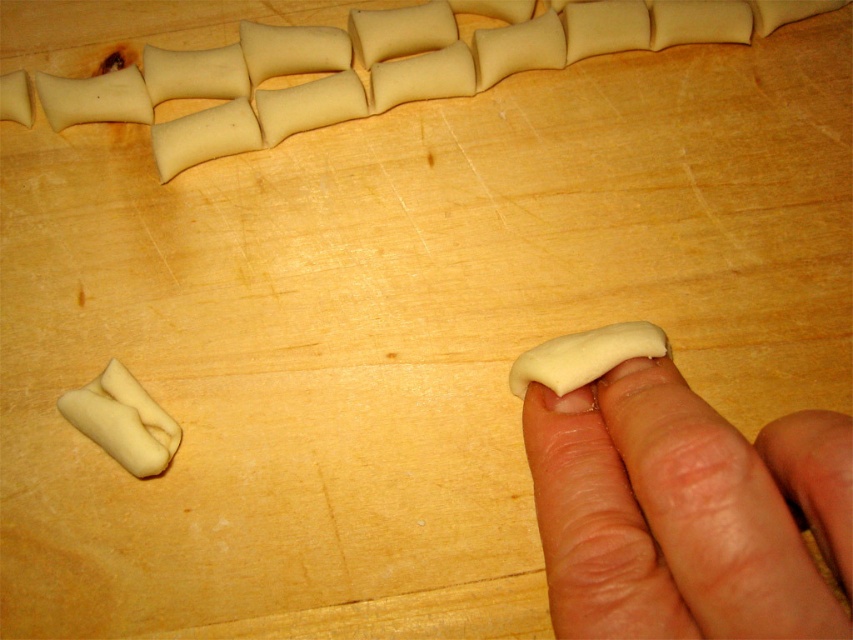
Question: Which is nearer to the white dough at center?

Choices:
 (A) smooth flesh at center
 (B) white dough at upper center
 (C) white dough at lower right

Answer: (C)

Question: Which is nearer to the white dough at upper center?

Choices:
 (A) white dough at lower right
 (B) white dough at center
 (C) smooth flesh at center

Answer: (B)

Question: From the image, what is the correct spatial relationship of smooth flesh at center in relation to white dough at upper center?

Choices:
 (A) left
 (B) right

Answer: (B)

Question: Which point is closer to the camera?

Choices:
 (A) smooth flesh at center
 (B) white dough at center

Answer: (A)

Question: Does white dough at upper center appear on the left side of white dough at lower right?

Choices:
 (A) no
 (B) yes

Answer: (B)

Question: Is smooth flesh at center thinner than white dough at center?

Choices:
 (A) no
 (B) yes

Answer: (A)